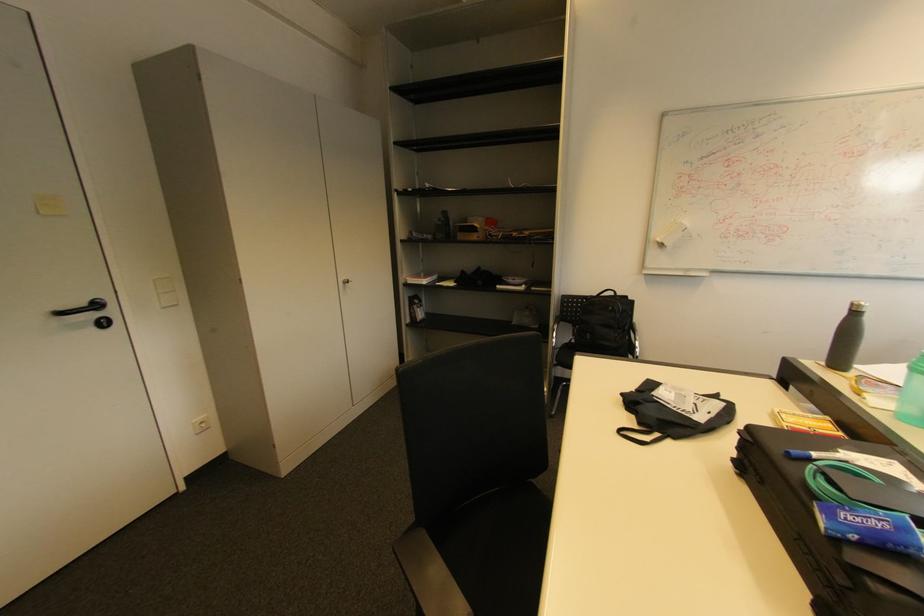
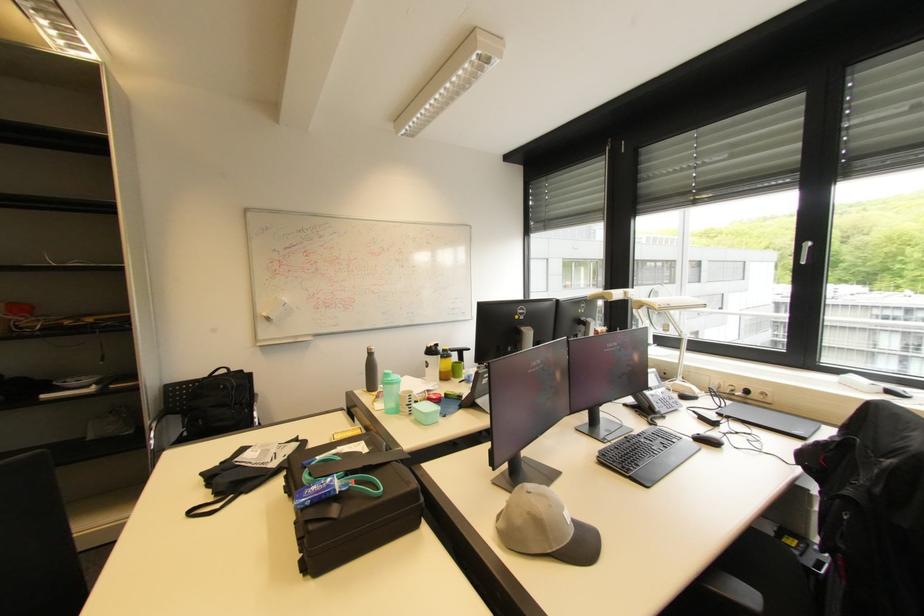
The point at [666,246] is marked in the first image. Where is the corresponding point in the second image?

(273, 320)